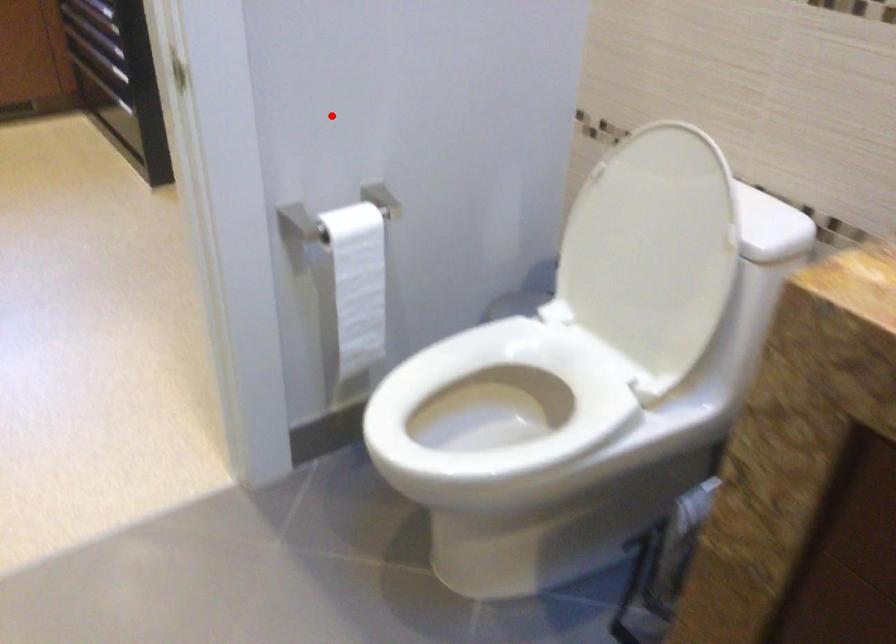
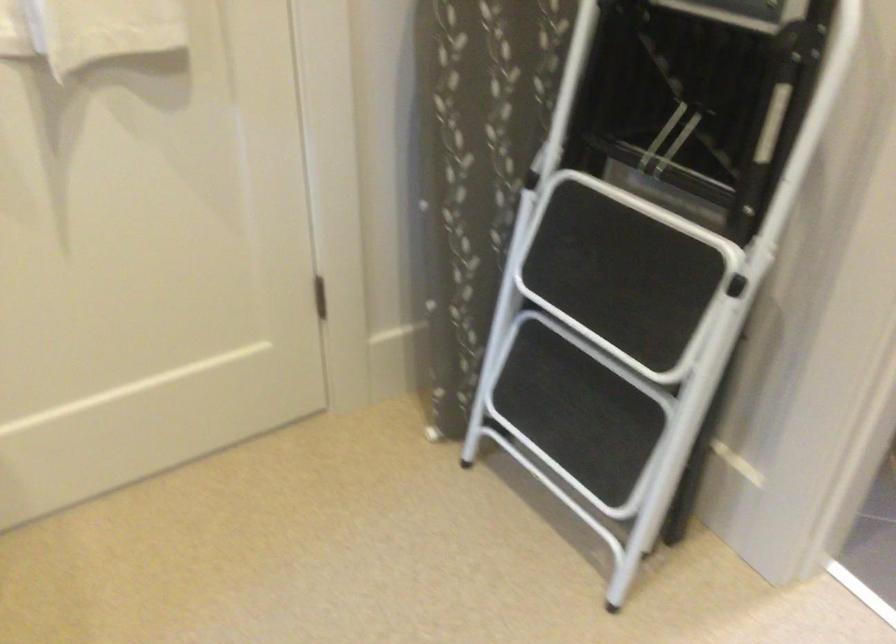
In the second image, find the point that corresponds to the highlighted location in the first image.

(658, 216)